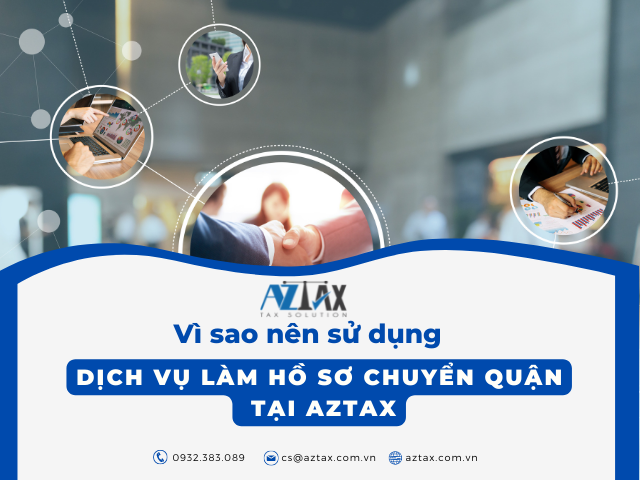
The width and height of the screenshot is (640, 480). In order to click on doorway in this screenshot , I will do `click(486, 166)`.